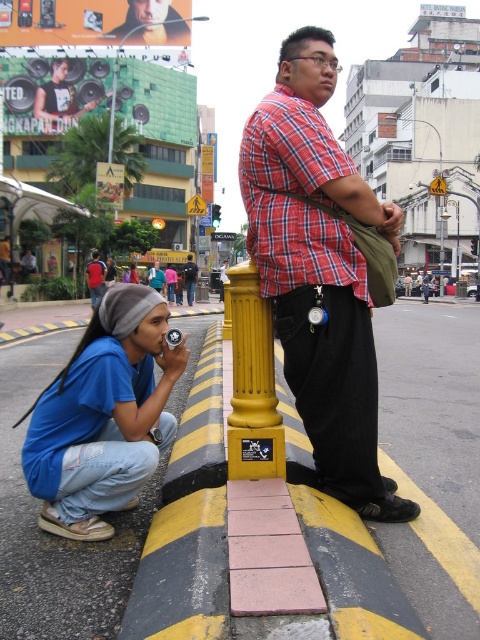
You are a photographer trying to capture a group photo of the matte red shirt at center and the pink fabric shirt at center. Based on their heights, which person should stand in the back to ensure both are fully visible?

The matte red shirt at center has a lesser height compared to the pink fabric shirt at center, so the matte red shirt at center should stand in the back to ensure both are fully visible.